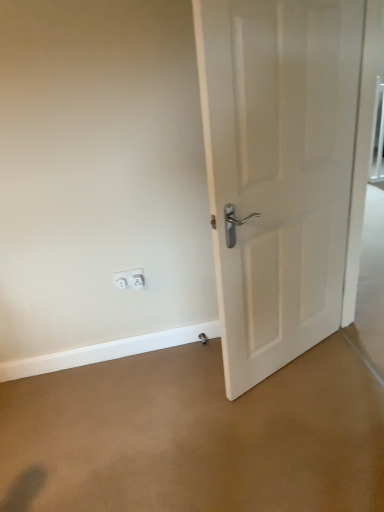
You are a GUI agent. You are given a task and a screenshot of the screen. Output one action in this format:
    pyautogui.click(x=<x>, y=<y>)
    Task: Click on the vacant area situated below white matte door at right (from a real-world perspective)
    The height and width of the screenshot is (512, 384).
    Given the screenshot: What is the action you would take?
    pyautogui.click(x=300, y=358)